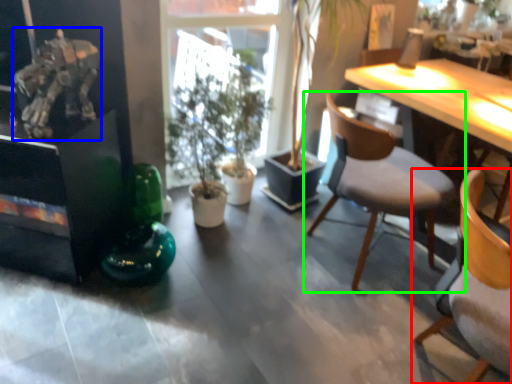
Question: Which object is positioned closest to chair (highlighted by a red box)? Select from art (highlighted by a blue box) and chair (highlighted by a green box).

Choices:
 (A) art
 (B) chair

Answer: (B)